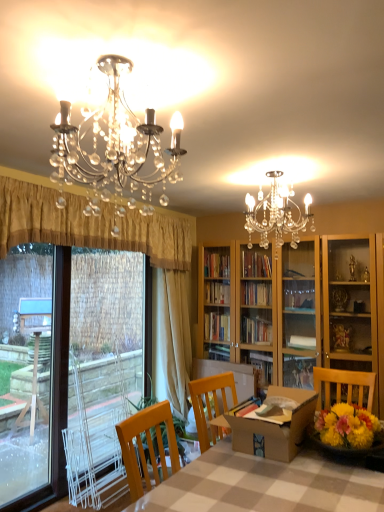
Question: Can you confirm if gold pleated curtain at left, placed as the 1th curtain when sorted from front to back, is positioned to the right of checkered fabric table at center?

Choices:
 (A) yes
 (B) no

Answer: (B)

Question: From a real-world perspective, is gold pleated curtain at left, placed as the 1th curtain when sorted from front to back, on top of checkered fabric table at center?

Choices:
 (A) yes
 (B) no

Answer: (A)

Question: From a real-world perspective, is gold pleated curtain at left, placed as the 1th curtain when sorted from front to back, located beneath checkered fabric table at center?

Choices:
 (A) no
 (B) yes

Answer: (A)

Question: Is gold pleated curtain at left, the second curtain positioned from the back, not near checkered fabric table at center?

Choices:
 (A) no
 (B) yes

Answer: (B)

Question: From the image's perspective, would you say gold pleated curtain at left, the second curtain positioned from the back, is shown under checkered fabric table at center?

Choices:
 (A) no
 (B) yes

Answer: (A)

Question: Would you say brown cardboard box at center is inside or outside checkered fabric table at center?

Choices:
 (A) inside
 (B) outside

Answer: (B)

Question: Considering the positions of point (302, 409) and point (380, 490), is point (302, 409) closer or farther from the camera than point (380, 490)?

Choices:
 (A) farther
 (B) closer

Answer: (A)

Question: From a real-world perspective, relative to checkered fabric table at center, is brown cardboard box at center vertically above or below?

Choices:
 (A) below
 (B) above

Answer: (B)

Question: Is brown cardboard box at center in front of or behind checkered fabric table at center in the image?

Choices:
 (A) front
 (B) behind

Answer: (B)

Question: From the image's perspective, relative to gold pleated curtain at left, placed as the 1th curtain when sorted from front to back, is clear plastic screen door at left above or below?

Choices:
 (A) below
 (B) above

Answer: (A)

Question: Is clear plastic screen door at left inside or outside of gold pleated curtain at left, placed as the 1th curtain when sorted from front to back?

Choices:
 (A) inside
 (B) outside

Answer: (B)

Question: Looking at their shapes, would you say clear plastic screen door at left is wider or thinner than gold pleated curtain at left, placed as the 1th curtain when sorted from front to back?

Choices:
 (A) thin
 (B) wide

Answer: (A)

Question: Considering their positions, is clear plastic screen door at left located in front of or behind gold pleated curtain at left, the second curtain positioned from the back?

Choices:
 (A) behind
 (B) front

Answer: (A)

Question: From their relative heights in the image, would you say beige fabric curtain at left, acting as the 1th curtain starting from the back, is taller or shorter than clear plastic screen door at left?

Choices:
 (A) tall
 (B) short

Answer: (B)

Question: From the image's perspective, relative to clear plastic screen door at left, is beige fabric curtain at left, acting as the 2th curtain starting from the front, above or below?

Choices:
 (A) above
 (B) below

Answer: (A)